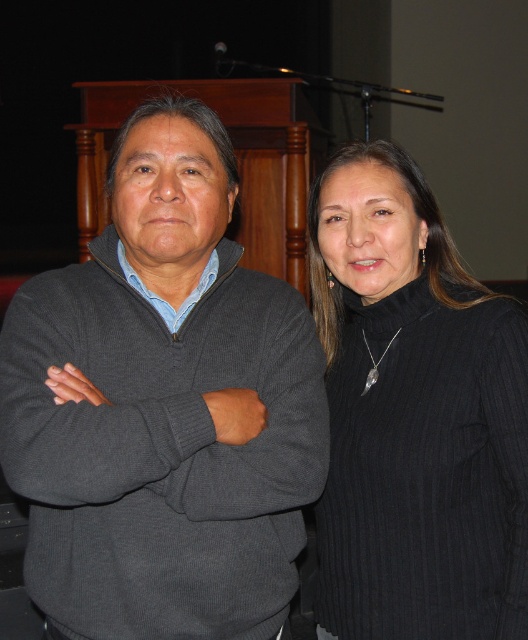
Can you confirm if dark gray sweater at center is positioned above black ribbed sweater at right?

Yes.

Between dark gray sweater at center and black ribbed sweater at right, which one has less height?

Standing shorter between the two is dark gray sweater at center.

Which is in front, point (220, 193) or point (517, 328)?

Point (517, 328)

I want to click on dark gray sweater at center, so click(164, 406).